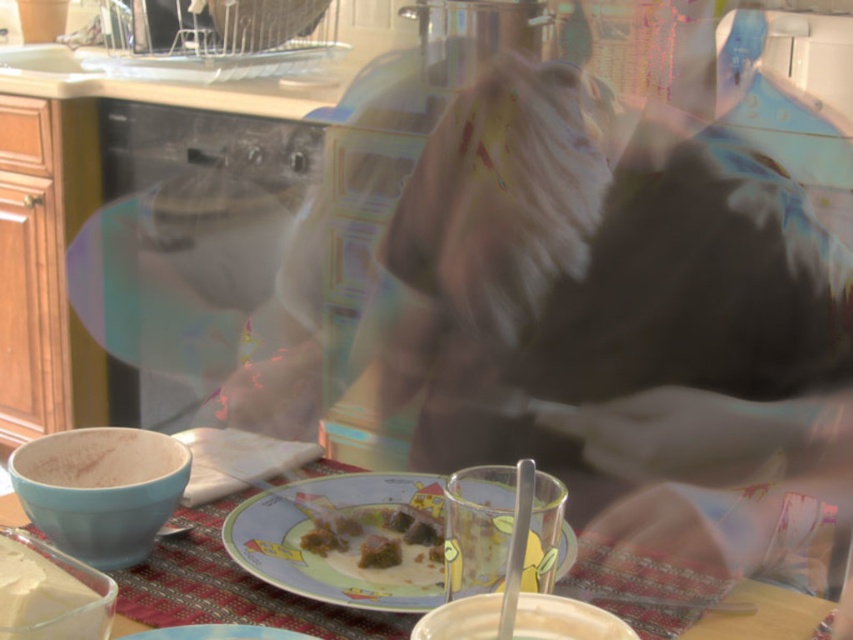
You are organizing a picnic and have two plates available. The decorative ceramic plate at center and the matte plastic plate at center. Which plate would you choose if you need more space to serve a large meal?

The matte plastic plate at center occupies more space than the decorative ceramic plate at center, so it would be better to choose the matte plastic plate at center for serving a large meal.

You are standing in the kitchen scene and want to reach a specific point in the image. The point is located at coordinates point (x=231, y=547). If your hand is 3 inches wide, can you comfortably reach that point without stretching too much?

The distance between you and the point (x=231, y=547) is 31.48 inches. Since your hand is only 3 inches wide, you can comfortably reach that point without stretching too much because the distance is manageable.

What is the object located at the coordinates point (x=329, y=556) in the kitchen scene?

The point (x=329, y=556) marks the location of the decorative ceramic plate at center.